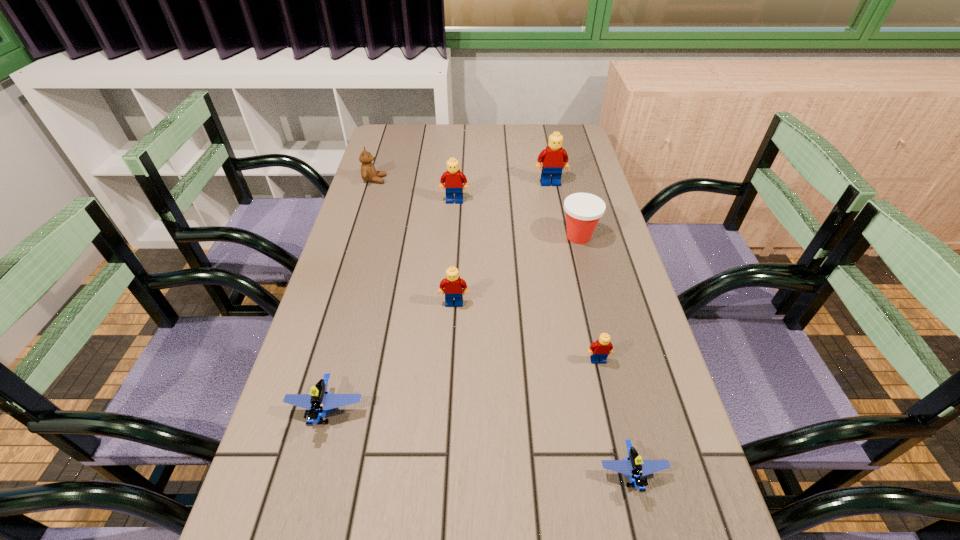
At what (x,y) coordinates should I click in order to perform the action: click on the farther blue Lego. Please return your answer as a coordinate pair (x, y). Looking at the image, I should click on (320, 400).

At what (x,y) coordinates should I click in order to perform the action: click on the fourth farthest Lego. Please return your answer as a coordinate pair (x, y). Image resolution: width=960 pixels, height=540 pixels. Looking at the image, I should click on (599, 350).

The height and width of the screenshot is (540, 960). Find the location of `the smallest yellow Lego`. the smallest yellow Lego is located at coordinates (599, 350).

At what (x,y) coordinates should I click in order to perform the action: click on the right blue Lego. Please return your answer as a coordinate pair (x, y). The height and width of the screenshot is (540, 960). Looking at the image, I should click on (633, 465).

At what (x,y) coordinates should I click in order to perform the action: click on the smaller blue Lego. Please return your answer as a coordinate pair (x, y). This screenshot has width=960, height=540. Looking at the image, I should click on (633, 465).

Image resolution: width=960 pixels, height=540 pixels. Identify the location of vacant region located 0.340m on the front-facing side of the farthest Lego. (565, 255).

Identify the location of vacant space located on the front-facing side of the second tallest Lego. This screenshot has width=960, height=540. (453, 226).

This screenshot has height=540, width=960. What are the coordinates of `free space located on the front-facing side of the third biggest yellow Lego` in the screenshot? It's located at (448, 408).

Locate an element on the screen. The height and width of the screenshot is (540, 960). vacant area situated on the front-facing side of the teddy bear is located at coordinates (474, 180).

Identify the location of vacant space located 0.370m on the left of the red-orange Dixie cup. The height and width of the screenshot is (540, 960). (432, 237).